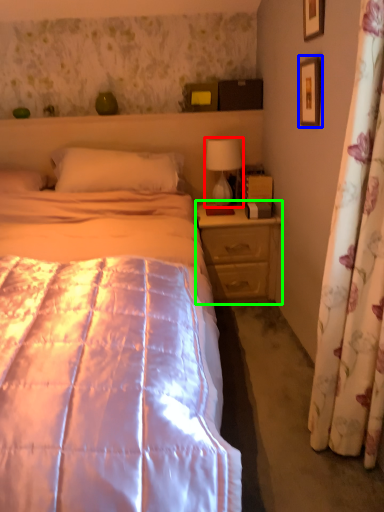
Question: Considering the real-world distances, which object is closest to table lamp (highlighted by a red box)? picture frame (highlighted by a blue box) or nightstand (highlighted by a green box).

Choices:
 (A) picture frame
 (B) nightstand

Answer: (B)